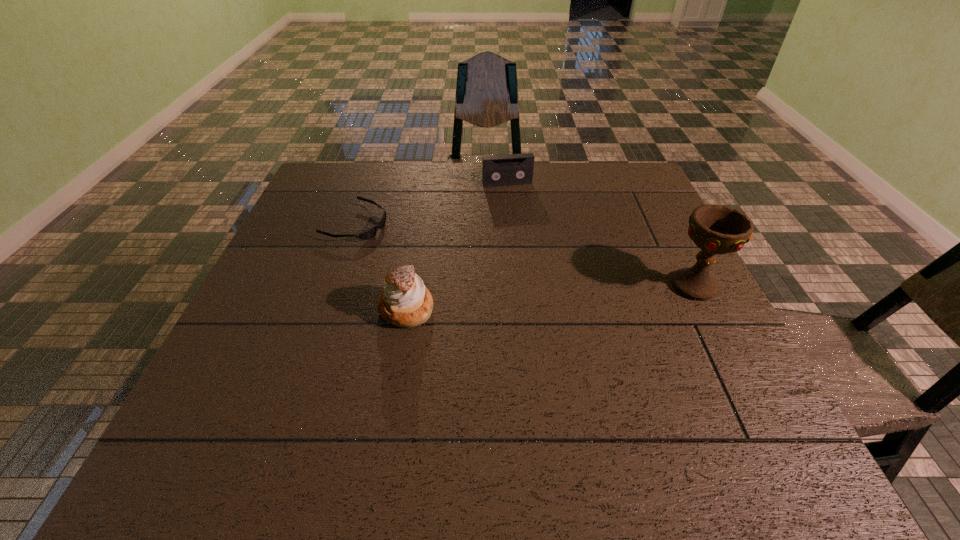
In order to click on vacant spot on the desktop that is between the pastry and the tallest object and is positioned on the front-facing side of the farthest object in this screenshot , I will do `click(546, 297)`.

You are a GUI agent. You are given a task and a screenshot of the screen. Output one action in this format:
    pyautogui.click(x=<x>, y=<y>)
    Task: Click on the free space on the desktop that is between the third shortest object and the tallest object and is positioned on the front-facing side of the leftmost object
    
    Given the screenshot: What is the action you would take?
    pyautogui.click(x=589, y=294)